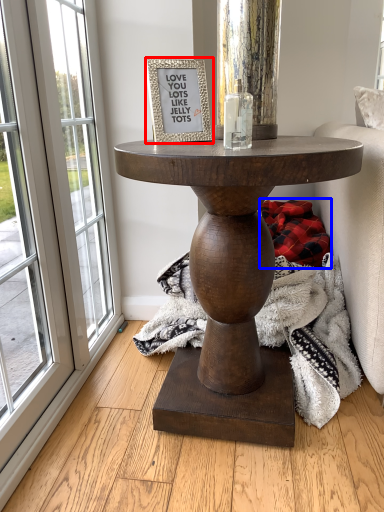
Question: Which object appears closest to the camera in this image, picture frame (highlighted by a red box) or blanket (highlighted by a blue box)?

Choices:
 (A) picture frame
 (B) blanket

Answer: (A)